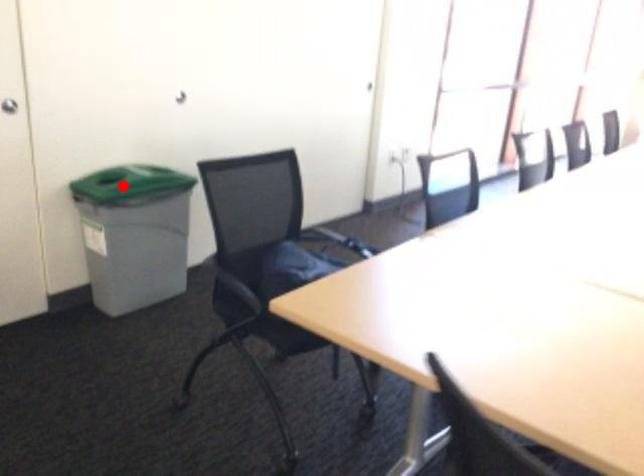
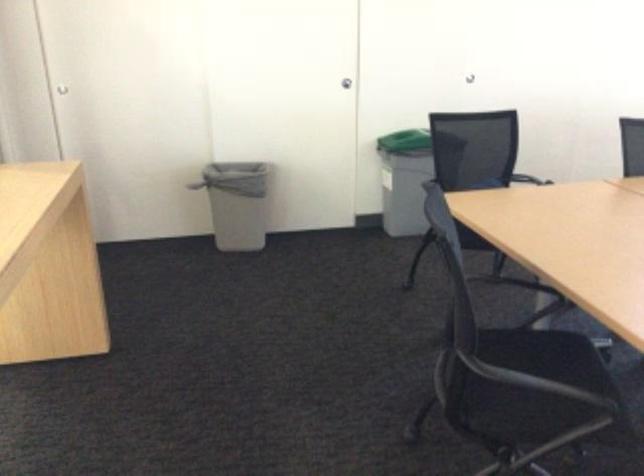
The point at the highlighted location is marked in the first image. Where is the corresponding point in the second image?

(404, 141)